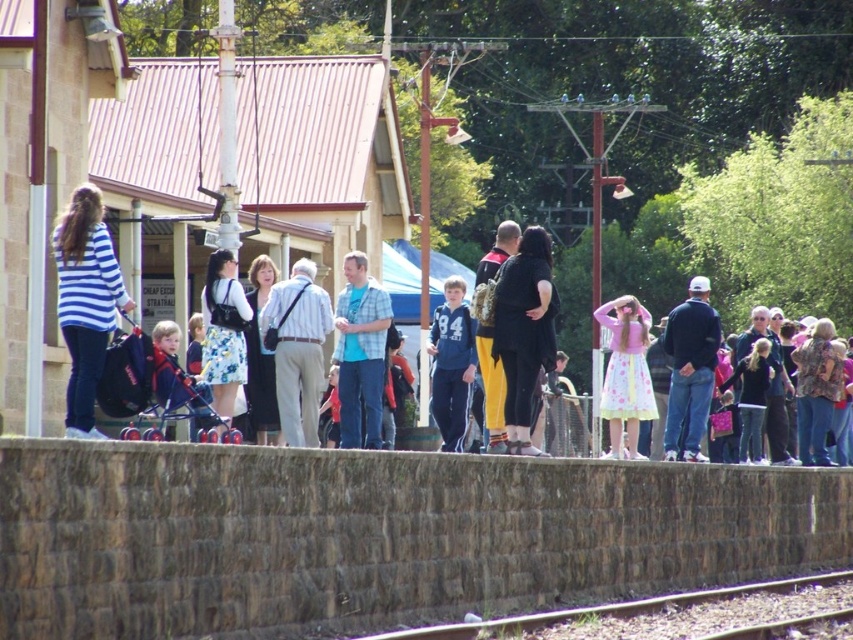
Question: Can you confirm if black matte dress at center is bigger than dark blue sweater at center?

Choices:
 (A) no
 (B) yes

Answer: (A)

Question: Observing the image, what is the correct spatial positioning of floral fabric dress at center in reference to smooth metal train track at lower center?

Choices:
 (A) right
 (B) left

Answer: (B)

Question: Based on their relative distances, which object is nearer to the smooth metal train track at lower center?

Choices:
 (A) striped cotton shirt at left
 (B) black matte dress at center

Answer: (B)

Question: Does pink floral skirt at center have a lesser width compared to matte black dress at center?

Choices:
 (A) no
 (B) yes

Answer: (A)

Question: Which object is farther from the camera taking this photo?

Choices:
 (A) blue fleece jacket at center
 (B) smooth metal train track at lower center
 (C) black matte dress at center

Answer: (A)

Question: Among these points, which one is farthest from the camera?

Choices:
 (A) (253, 374)
 (B) (496, 266)
 (C) (94, 243)

Answer: (A)